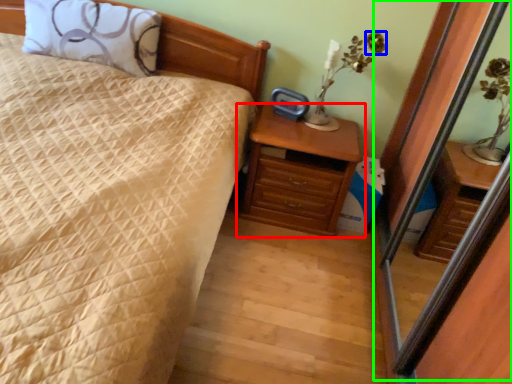
Question: Which object is the closest to the chest of drawers (highlighted by a red box)? Choose among these: flower (highlighted by a blue box) or screen door (highlighted by a green box).

Choices:
 (A) flower
 (B) screen door

Answer: (B)